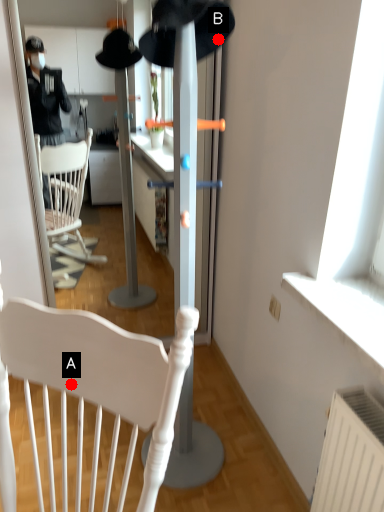
Question: Two points are circled on the image, labeled by A and B beside each circle. Which of the following is the farthest from the observer?

Choices:
 (A) A is further
 (B) B is further

Answer: (B)